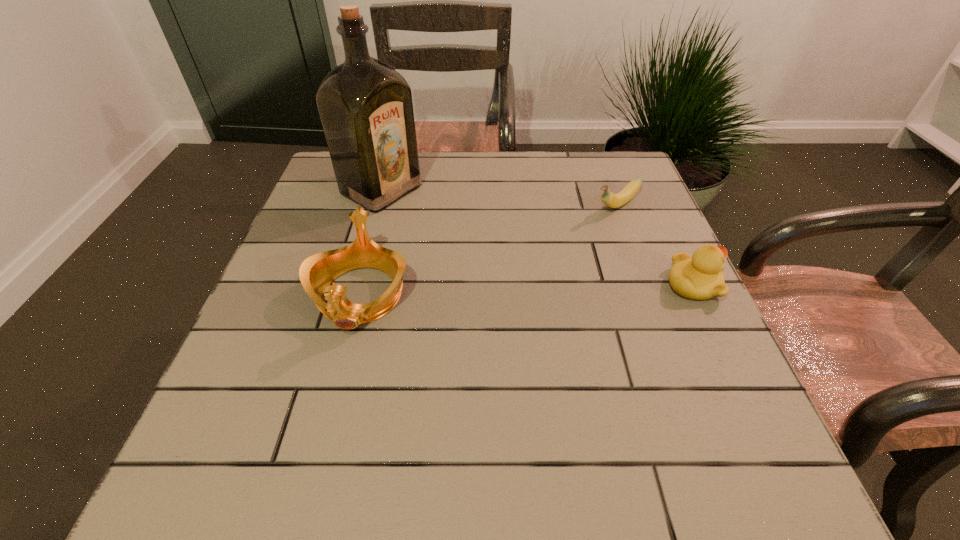
The width and height of the screenshot is (960, 540). I want to click on the second tallest object, so click(x=317, y=272).

The width and height of the screenshot is (960, 540). What are the coordinates of `duckling` in the screenshot? It's located at pyautogui.click(x=698, y=277).

You are a GUI agent. You are given a task and a screenshot of the screen. Output one action in this format:
    pyautogui.click(x=<x>, y=<y>)
    Task: Click on the banana
    The width and height of the screenshot is (960, 540).
    Given the screenshot: What is the action you would take?
    pyautogui.click(x=628, y=192)

Identify the location of liquor. (365, 106).

Locate an element on the screen. The width and height of the screenshot is (960, 540). free space located 0.100m at the front emblem of the third shortest object is located at coordinates (334, 392).

You are a GUI agent. You are given a task and a screenshot of the screen. Output one action in this format:
    pyautogui.click(x=<x>, y=<y>)
    Task: Click on the free space located at the stem of the banana
    
    Given the screenshot: What is the action you would take?
    pyautogui.click(x=541, y=256)

This screenshot has width=960, height=540. I want to click on blank space located at the stem of the banana, so click(x=564, y=241).

At what (x,y) coordinates should I click in order to perform the action: click on vacant area situated 0.300m at the stem of the banana. Please return your answer as a coordinate pair (x, y). This screenshot has width=960, height=540. Looking at the image, I should click on (516, 273).

Where is `free space located 0.280m on the label of the liquor`? free space located 0.280m on the label of the liquor is located at coordinates (494, 251).

This screenshot has height=540, width=960. What are the coordinates of `vacant space situated 0.160m on the label of the liquor` in the screenshot? It's located at (456, 230).